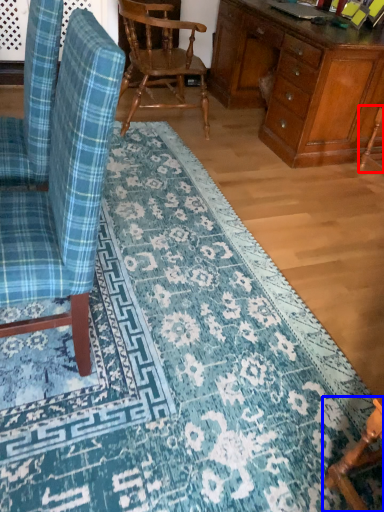
Question: Which object is closer to the camera taking this photo, armchair (highlighted by a red box) or chair (highlighted by a blue box)?

Choices:
 (A) armchair
 (B) chair

Answer: (B)